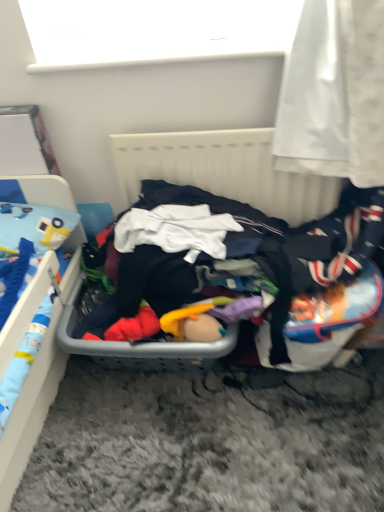
What do you see at coordinates (223, 170) in the screenshot?
I see `white plastic radiator at center` at bounding box center [223, 170].

Identify the location of blue plastic bed at left. (36, 389).

Does point (156, 158) come behind point (230, 18)?

Yes, point (156, 158) is farther from viewer.

Does white plastic radiator at center appear on the right side of white matte window screen at upper center?

Correct, you'll find white plastic radiator at center to the right of white matte window screen at upper center.

Are white plastic radiator at center and white matte window screen at upper center located far from each other?

That's not correct — white plastic radiator at center is a little close to white matte window screen at upper center.

Can you see white matte window screen at upper center touching dark fabric clothes at center?

white matte window screen at upper center and dark fabric clothes at center are not in contact.

Which object is wider, white matte window screen at upper center or dark fabric clothes at center?

dark fabric clothes at center is wider.

Is dark fabric clothes at center a part of white matte window screen at upper center?

No, white matte window screen at upper center does not contain dark fabric clothes at center.

Between dark fabric clothes at center and blue plastic bed at left, which one is positioned in front?

blue plastic bed at left.

Is dark fabric clothes at center placed right next to blue plastic bed at left?

dark fabric clothes at center and blue plastic bed at left are not in contact.

From the image's perspective, would you say dark fabric clothes at center is positioned over blue plastic bed at left?

Yes, from the image's perspective, dark fabric clothes at center is on top of blue plastic bed at left.

Between point (104, 259) and point (73, 233), which one is positioned in front?

The point (73, 233) is closer.

From a real-world perspective, does white plastic radiator at center sit lower than blue plastic bed at left?

No, from a real-world perspective, white plastic radiator at center is not beneath blue plastic bed at left.

Is white plastic radiator at center looking in the opposite direction of blue plastic bed at left?

No, white plastic radiator at center is not facing away from blue plastic bed at left.

From the image's perspective, which one is positioned lower, white plastic radiator at center or blue plastic bed at left?

From the image's view, blue plastic bed at left is below.

This screenshot has width=384, height=512. I want to click on window screen above the dark fabric clothes at center (from the image's perspective), so click(154, 31).

From the image's perspective, is dark fabric clothes at center below white matte window screen at upper center?

Correct, dark fabric clothes at center appears lower than white matte window screen at upper center in the image.

Which of these two, dark fabric clothes at center or white matte window screen at upper center, is smaller?

white matte window screen at upper center.

Can you tell me how much dark fabric clothes at center and white matte window screen at upper center differ in facing direction?

The angular difference between dark fabric clothes at center and white matte window screen at upper center is 0.382 degrees.

Identify the location of window screen above the white plastic radiator at center (from the image's perspective). (154, 31).

Is white matte window screen at upper center aimed at white plastic radiator at center?

No, white matte window screen at upper center is not facing towards white plastic radiator at center.

Is white plastic radiator at center completely or partially inside white matte window screen at upper center?

Actually, white plastic radiator at center is outside white matte window screen at upper center.

Could dark fabric clothes at center be considered to be inside blue plastic bed at left?

No, dark fabric clothes at center is located outside of blue plastic bed at left.

Can you confirm if blue plastic bed at left is taller than dark fabric clothes at center?

Yes, blue plastic bed at left is taller than dark fabric clothes at center.

Which of these two, blue plastic bed at left or dark fabric clothes at center, is smaller?

dark fabric clothes at center is smaller.

Does point (32, 441) appear closer or farther from the camera than point (147, 180)?

Point (32, 441).

In order to click on radiator located underneath the white matte window screen at upper center (from a real-world perspective) in this screenshot , I will do `click(223, 170)`.

There is a dark fabric clothes at center. At what (x,y) coordinates should I click in order to perform the action: click on window screen above it (from a real-world perspective). Please return your answer as a coordinate pair (x, y). The width and height of the screenshot is (384, 512). Looking at the image, I should click on (154, 31).

Based on their spatial positions, is blue plastic bed at left or white plastic radiator at center further from dark fabric clothes at center?

blue plastic bed at left is further to dark fabric clothes at center.

When comparing their distances from white plastic radiator at center, does white matte window screen at upper center or blue plastic bed at left seem closer?

Among the two, white matte window screen at upper center is located nearer to white plastic radiator at center.

When comparing their distances from white matte window screen at upper center, does blue plastic bed at left or dark fabric clothes at center seem closer?

dark fabric clothes at center is closer to white matte window screen at upper center.

Based on their spatial positions, is dark fabric clothes at center or white plastic radiator at center further from blue plastic bed at left?

white plastic radiator at center lies further to blue plastic bed at left than the other object.

Estimate the real-world distances between objects in this image. Which object is closer to dark fabric clothes at center, blue plastic bed at left or white matte window screen at upper center?

blue plastic bed at left lies closer to dark fabric clothes at center than the other object.

Considering their positions, is white matte window screen at upper center positioned closer to dark fabric clothes at center than white plastic radiator at center?

white plastic radiator at center is closer to dark fabric clothes at center.

Looking at the image, which one is located closer to white matte window screen at upper center, dark fabric clothes at center or white plastic radiator at center?

white plastic radiator at center lies closer to white matte window screen at upper center than the other object.

Considering their positions, is blue plastic bed at left positioned further to white plastic radiator at center than dark fabric clothes at center?

The object further to white plastic radiator at center is blue plastic bed at left.

Where is `clothing between white matte window screen at upper center and blue plastic bed at left vertically`? This screenshot has height=512, width=384. clothing between white matte window screen at upper center and blue plastic bed at left vertically is located at coordinates (247, 271).

Identify the location of radiator between blue plastic bed at left and dark fabric clothes at center from left to right. The height and width of the screenshot is (512, 384). (223, 170).

Identify the location of radiator between white matte window screen at upper center and blue plastic bed at left in the vertical direction. (223, 170).

You are a GUI agent. You are given a task and a screenshot of the screen. Output one action in this format:
    pyautogui.click(x=<x>, y=<y>)
    Task: Click on the radiator between white matte window screen at upper center and dark fabric clothes at center in the vertical direction
    The width and height of the screenshot is (384, 512).
    Given the screenshot: What is the action you would take?
    pyautogui.click(x=223, y=170)